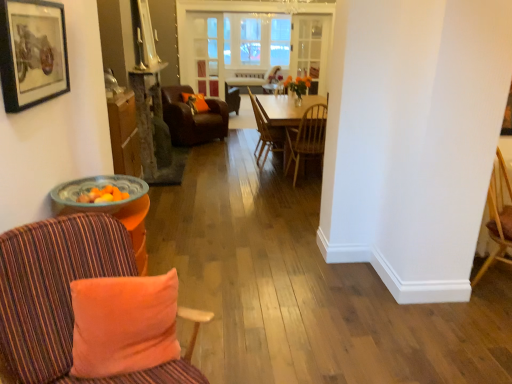
Question: Relative to wooden chair at center, which is the 3th chair in back-to-front order, is wooden chair at center, marked as the 3th chair in a front-to-back arrangement, in front or behind?

Choices:
 (A) behind
 (B) front

Answer: (A)

Question: Considering the positions of wooden chair at center, positioned as the 2th chair in back-to-front order, and wooden chair at center, which is the 3th chair in back-to-front order, in the image, is wooden chair at center, positioned as the 2th chair in back-to-front order, wider or thinner than wooden chair at center, which is the 3th chair in back-to-front order,?

Choices:
 (A) wide
 (B) thin

Answer: (A)

Question: Which of these objects is positioned closest to the striped fabric chair at left, arranged as the first chair when viewed from the front?

Choices:
 (A) clear glass door at center, placed as the 2th glass door when sorted from right to left
 (B) orange plush pillow at lower left, the first pillow viewed from the right
 (C) matte black picture frame at upper left
 (D) clear glass door at center, which ranks as the 1th glass door in right-to-left order
 (E) leather armchair at center, acting as the first chair starting from the back

Answer: (B)

Question: Which of these objects is positioned closest to the orange fabric pillow at center, positioned as the first pillow in top-to-bottom order?

Choices:
 (A) matte black picture frame at upper left
 (B) translucent glass bowl at left
 (C) wooden chair at center, positioned as the 2th chair in back-to-front order
 (D) wooden chair at center, which is the 3th chair in back-to-front order
 (E) orange plush pillow at lower left, the first pillow viewed from the right

Answer: (C)